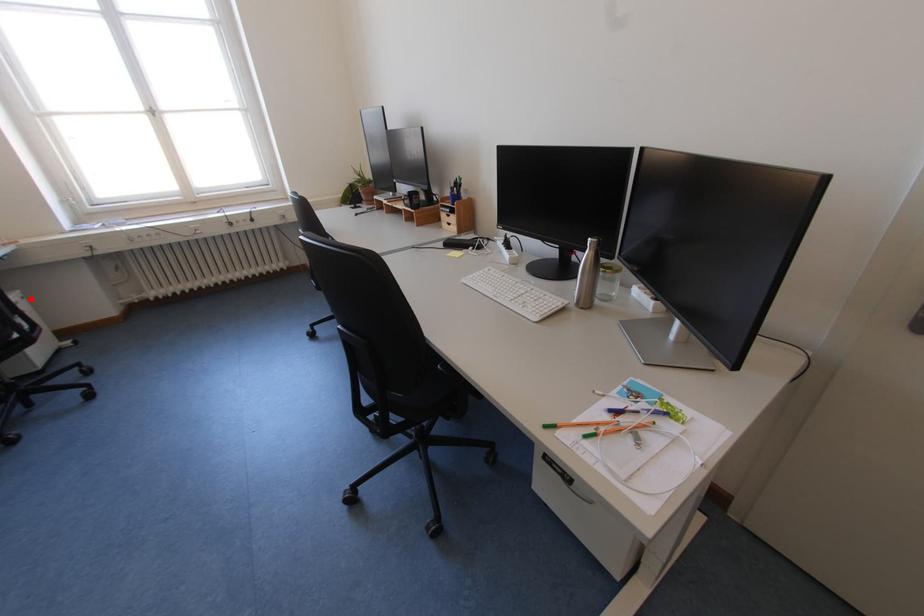
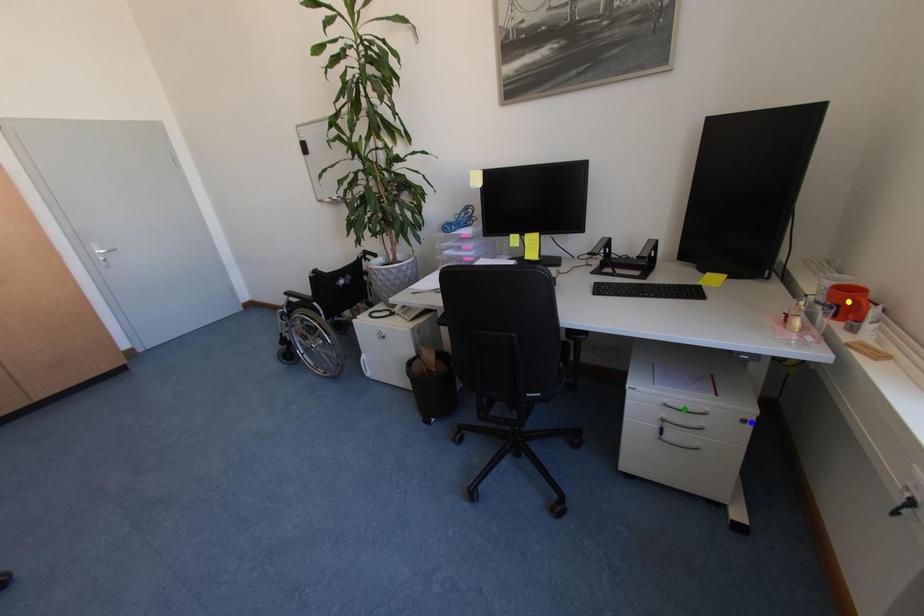
Question: I am providing you with two images of the same scene from different viewpoints. A red point is marked on the first image. You are given multiple points on the second image. Can you choose the point in image 2 that corresponds to the point in image 1?

Choices:
 (A) green point
 (B) yellow point
 (C) blue point

Answer: (C)